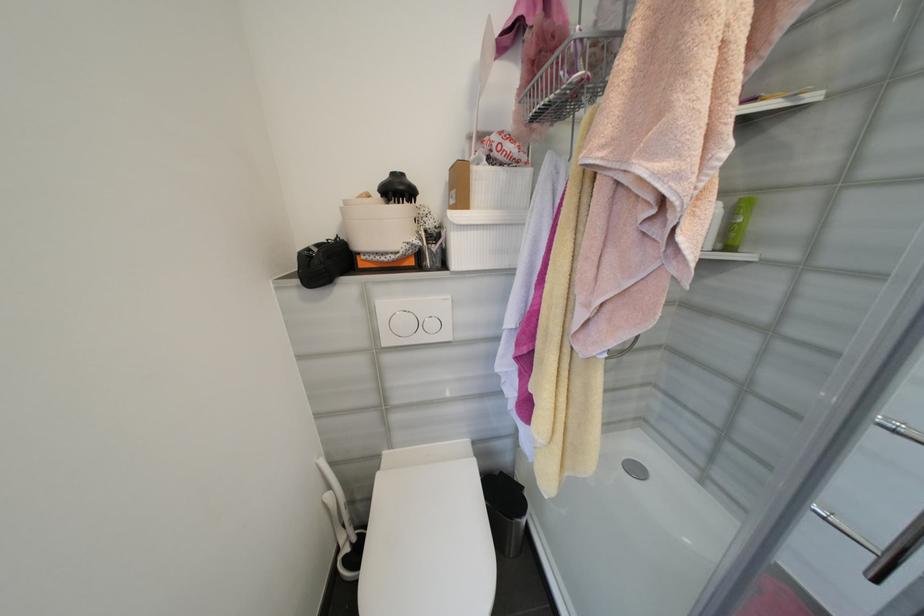
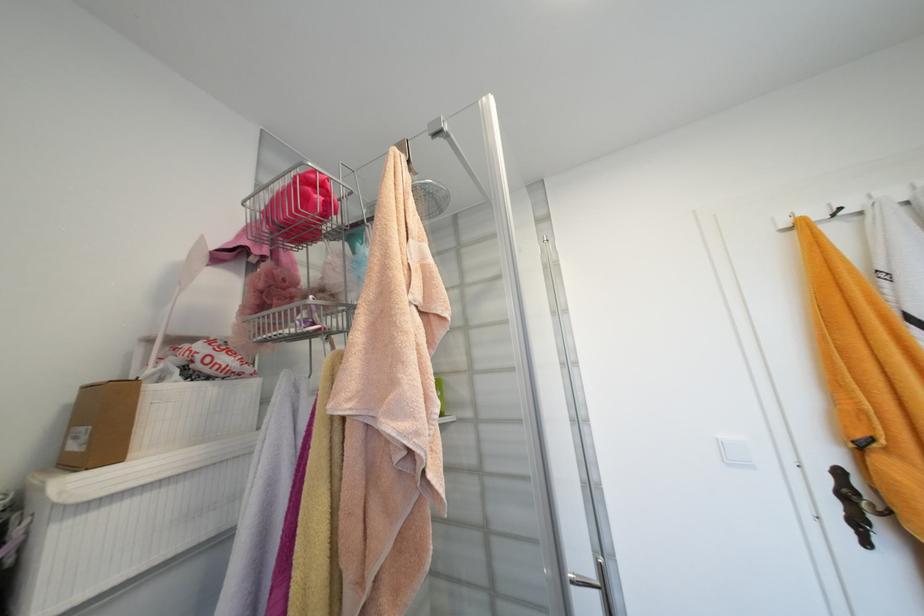
In the second image, find the point that corresponds to the point at 476,138 in the first image.

(154, 342)